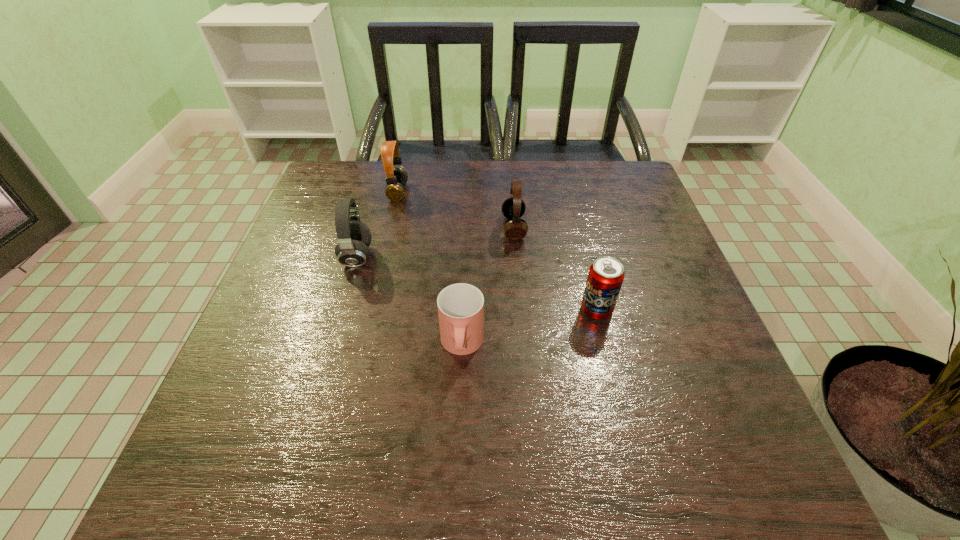
Locate an element on the screen. The height and width of the screenshot is (540, 960). the closest headset relative to the soda can is located at coordinates (513, 208).

Where is `headset that can be found as the closest to the cup`? The image size is (960, 540). headset that can be found as the closest to the cup is located at coordinates (354, 237).

I want to click on free point that satisfies the following two spatial constraints: 1. on the ear cups of the farthest object; 2. on the back side of the rightmost object, so click(x=371, y=310).

At what (x,y) coordinates should I click in order to perform the action: click on free space that satisfies the following two spatial constraints: 1. on the ear pads of the fourth object from left to right; 2. on the side of the shortest object with the handle. Please return your answer as a coordinate pair (x, y). The image size is (960, 540). Looking at the image, I should click on (524, 346).